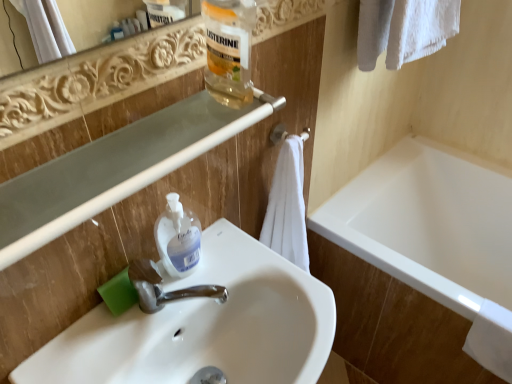
Question: From the image's perspective, would you say white matte towel bar at center is shown under translucent plastic bottle at upper center?

Choices:
 (A) yes
 (B) no

Answer: (A)

Question: Are white matte towel bar at center and translucent plastic bottle at upper center beside each other?

Choices:
 (A) no
 (B) yes

Answer: (A)

Question: From the image's perspective, is white matte towel bar at center located above translucent plastic bottle at upper center?

Choices:
 (A) no
 (B) yes

Answer: (A)

Question: Is white matte towel bar at center not near translucent plastic bottle at upper center?

Choices:
 (A) yes
 (B) no

Answer: (B)

Question: Is translucent plastic bottle at upper center a part of white matte towel bar at center?

Choices:
 (A) no
 (B) yes

Answer: (A)

Question: Is point (123, 127) positioned closer to the camera than point (174, 370)?

Choices:
 (A) closer
 (B) farther

Answer: (A)

Question: In terms of size, does clear plastic balustrade at upper center appear bigger or smaller than white glossy sink at center?

Choices:
 (A) small
 (B) big

Answer: (A)

Question: Is clear plastic balustrade at upper center situated inside white glossy sink at center or outside?

Choices:
 (A) inside
 (B) outside

Answer: (B)

Question: Considering the positions of clear plastic balustrade at upper center and white glossy sink at center in the image, is clear plastic balustrade at upper center wider or thinner than white glossy sink at center?

Choices:
 (A) thin
 (B) wide

Answer: (A)

Question: In the image, is translucent plastic bottle at upper center on the left side or the right side of white matte towel bar at center?

Choices:
 (A) right
 (B) left

Answer: (B)

Question: Considering the positions of translucent plastic bottle at upper center and white matte towel bar at center in the image, is translucent plastic bottle at upper center wider or thinner than white matte towel bar at center?

Choices:
 (A) wide
 (B) thin

Answer: (B)

Question: In terms of size, does translucent plastic bottle at upper center appear bigger or smaller than white matte towel bar at center?

Choices:
 (A) big
 (B) small

Answer: (A)

Question: From their relative heights in the image, would you say translucent plastic bottle at upper center is taller or shorter than white matte towel bar at center?

Choices:
 (A) tall
 (B) short

Answer: (A)

Question: Do you think white glossy bathtub at lower right is within white glossy sink at center, or outside of it?

Choices:
 (A) inside
 (B) outside

Answer: (B)

Question: Is point (406, 332) positioned closer to the camera than point (268, 253)?

Choices:
 (A) farther
 (B) closer

Answer: (A)